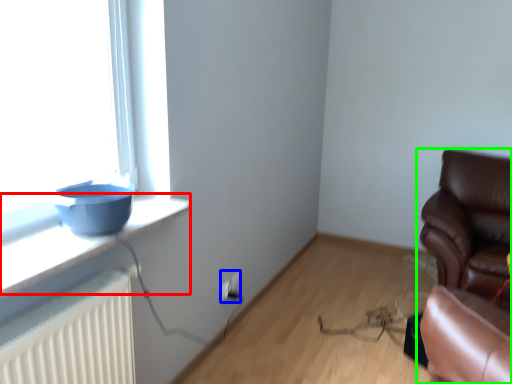
Question: Based on their relative distances, which object is farther from window sill (highlighted by a red box)? Choose from electric outlet (highlighted by a blue box) and chair (highlighted by a green box).

Choices:
 (A) electric outlet
 (B) chair

Answer: (B)